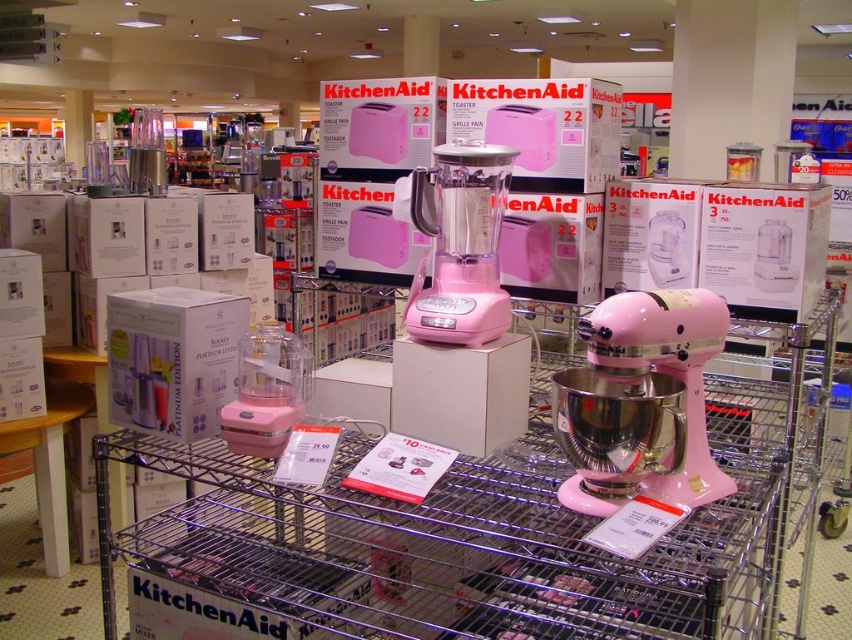
Question: Which object is the closest to the pink matte stand mixer at center?

Choices:
 (A) matte white blender at center
 (B) pink plastic blender at center
 (C) pink matte blender at center

Answer: (C)

Question: Is pink matte blender at center behind pink plastic blender at center?

Choices:
 (A) no
 (B) yes

Answer: (A)

Question: Does pink matte blender at center have a lesser width compared to pink plastic blender at center?

Choices:
 (A) no
 (B) yes

Answer: (A)

Question: Which point is farther from the camera taking this photo?

Choices:
 (A) (502, 156)
 (B) (235, 449)
 (C) (666, 291)

Answer: (B)

Question: Which object is positioned closest to the pink matte stand mixer at center?

Choices:
 (A) matte white blender at center
 (B) pink plastic blender at center

Answer: (B)

Question: Can you confirm if pink matte blender at center is smaller than pink matte stand mixer at center?

Choices:
 (A) yes
 (B) no

Answer: (A)